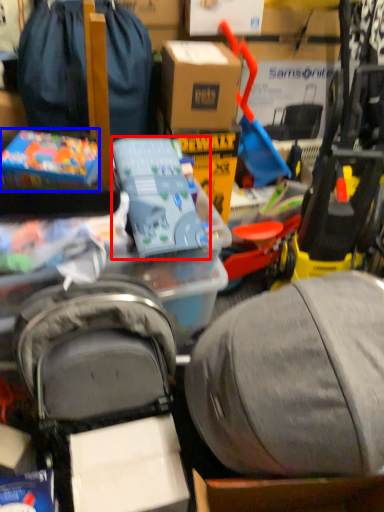
Question: Which object appears farthest to the camera in this image, toy (highlighted by a red box) or toy (highlighted by a blue box)?

Choices:
 (A) toy
 (B) toy

Answer: (B)